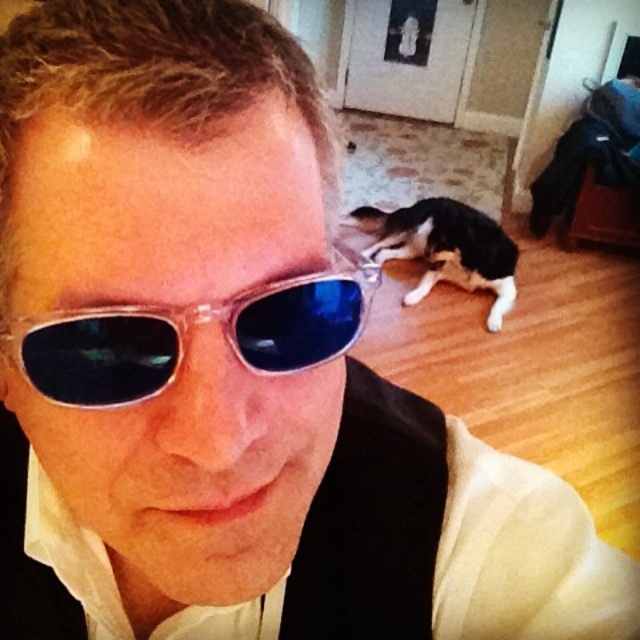
Question: Which point is closer to the camera?

Choices:
 (A) (493, 237)
 (B) (180, 346)

Answer: (B)

Question: Can you confirm if transparent plastic sunglasses at center is positioned to the left of black and white fur at lower center?

Choices:
 (A) yes
 (B) no

Answer: (A)

Question: Which point is closer to the camera?

Choices:
 (A) (412, 241)
 (B) (305, 284)

Answer: (B)

Question: Observing the image, what is the correct spatial positioning of transparent plastic sunglasses at center in reference to black and white fur at lower center?

Choices:
 (A) above
 (B) below

Answer: (B)

Question: Is transparent plastic sunglasses at center wider than black and white fur at lower center?

Choices:
 (A) no
 (B) yes

Answer: (A)

Question: Which point is farther from the camera taking this photo?

Choices:
 (A) (365, 257)
 (B) (305, 330)

Answer: (A)